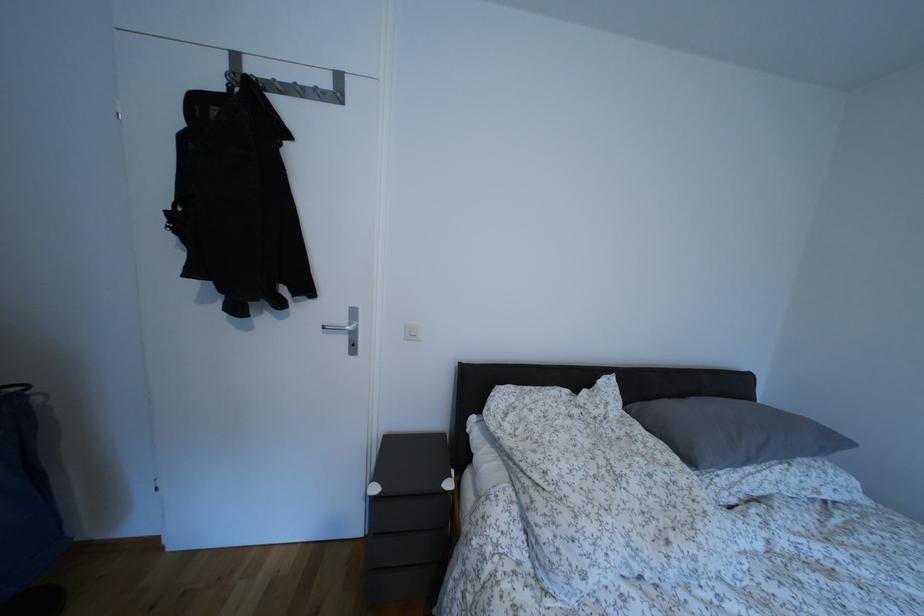
Identify the location of metal door handle. (338, 328).